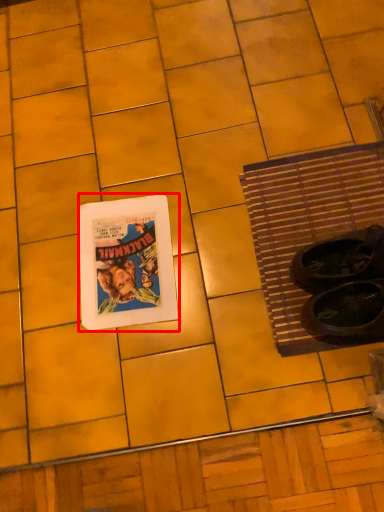
Question: Where is picture frame (annotated by the red box) located in relation to bath mat in the image?

Choices:
 (A) right
 (B) left

Answer: (B)